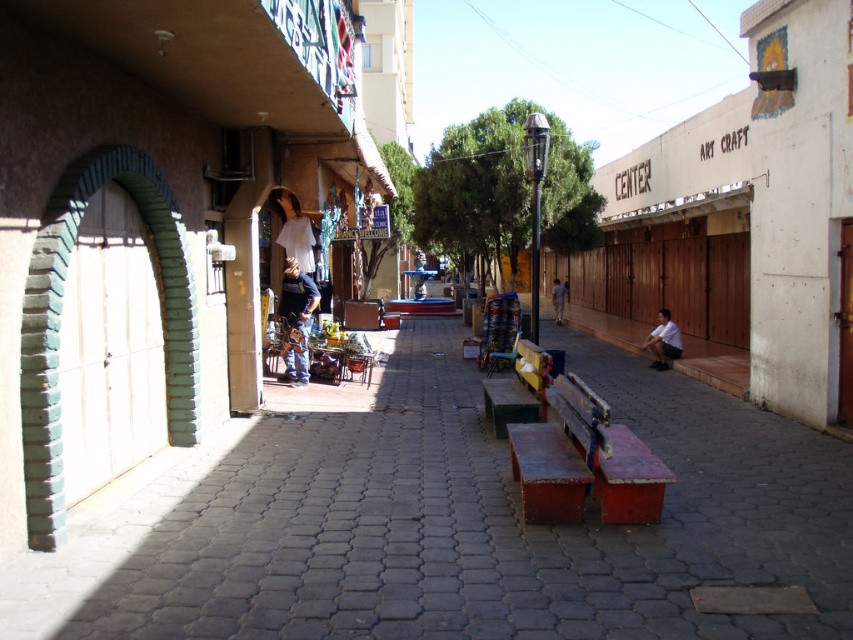
You are a delivery person standing at the end of the street. You need to deliver a package to the person wearing denim jeans at center and white matte shirt at center. If you can walk 3 feet per second, how many seconds will it take you to reach them both?

The distance between denim jeans at center and white matte shirt at center is 24.05 feet. Since you need to reach both, you can calculate the time by dividing the distance by your walking speed. 24.05 feet divided by 3 feet per second equals approximately 8.02 seconds. Therefore, it will take about 8 seconds to reach them both.

From the picture: You are standing on the narrow street and want to sit down on the rusty wood bench at center. However, there is a person in a white matte shirt at center blocking your path. Based on their positions, can you move around them to reach the bench without crossing their path?

The rusty wood bench at center is to the left of the white matte shirt at center, so you can move around the person to the left side to reach the bench without crossing their path.

You are standing on the narrow street scene and want to reach a specific location marked by point (x=669, y=404) and point (x=289, y=352). Which point is closer to your current position?

Point (x=669, y=404) is closer to the viewer than point (x=289, y=352).